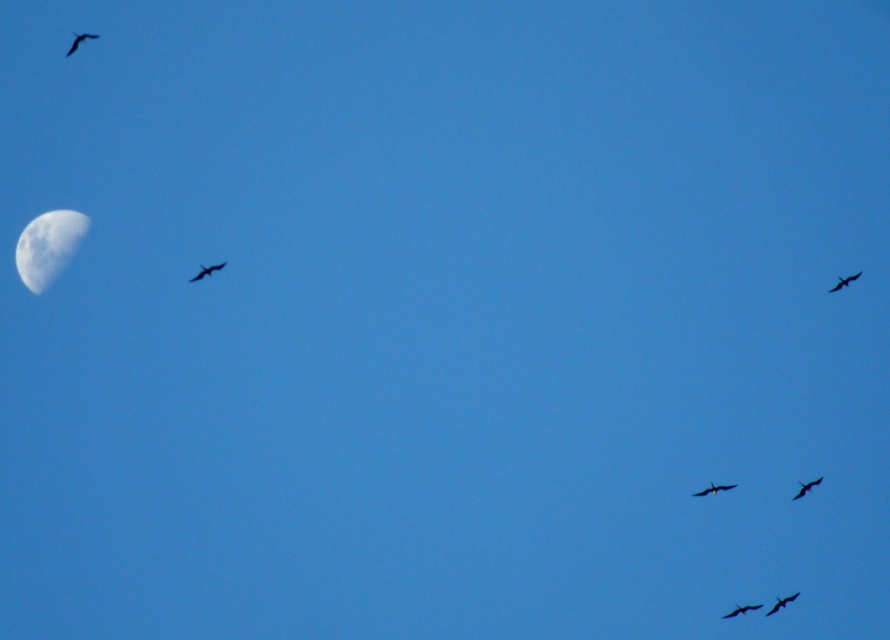
You are an astronomer observing the sky. You notice the white matte moon at upper left and the smooth black bird at lower right. Which object is located higher in the sky?

The white matte moon at upper left is positioned over the smooth black bird at lower right, so it is higher in the sky.

You are an astronomer observing the sky from a telescope located at the center of the image. You notice the white matte moon at upper left and the silhouette glossy bird at upper left. If the distance between them is 92.96 meters, can you determine which object is closer to your telescope based on their positions?

The white matte moon at upper left and silhouette glossy bird at upper left are 92.96 meters apart. Since both objects are at the same position in the upper left, their distance from the telescope depends on their actual locations in space. However, without additional information about their depth or altitude, it is impossible to determine which is closer based solely on their horizontal separation.

You are an ornithologist observing birds in the sky. You notice a silhouette glossy bird at upper left and a black glossy bird at center. Which bird appears wider when viewed from your position?

The silhouette glossy bird at upper left appears wider than the black glossy bird at center because its width is larger.